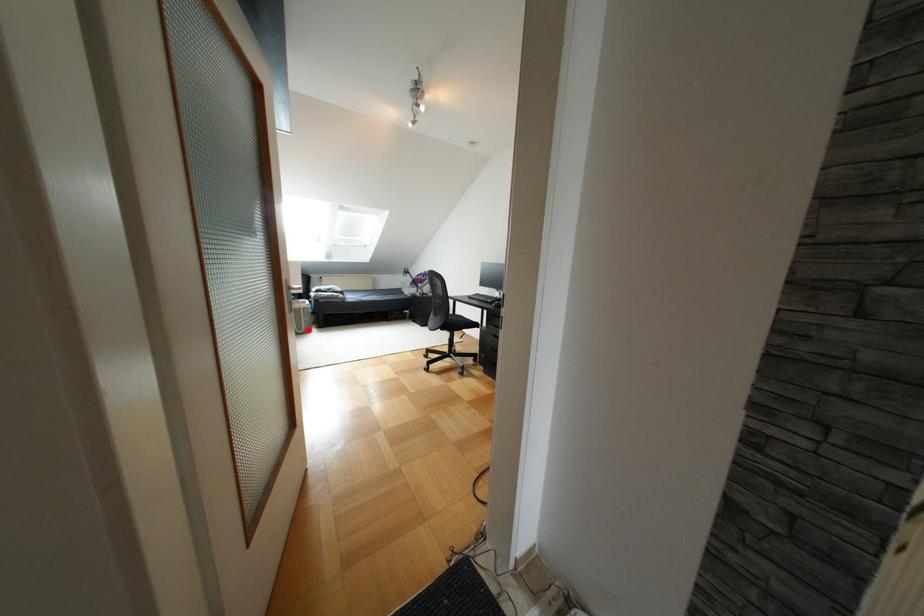
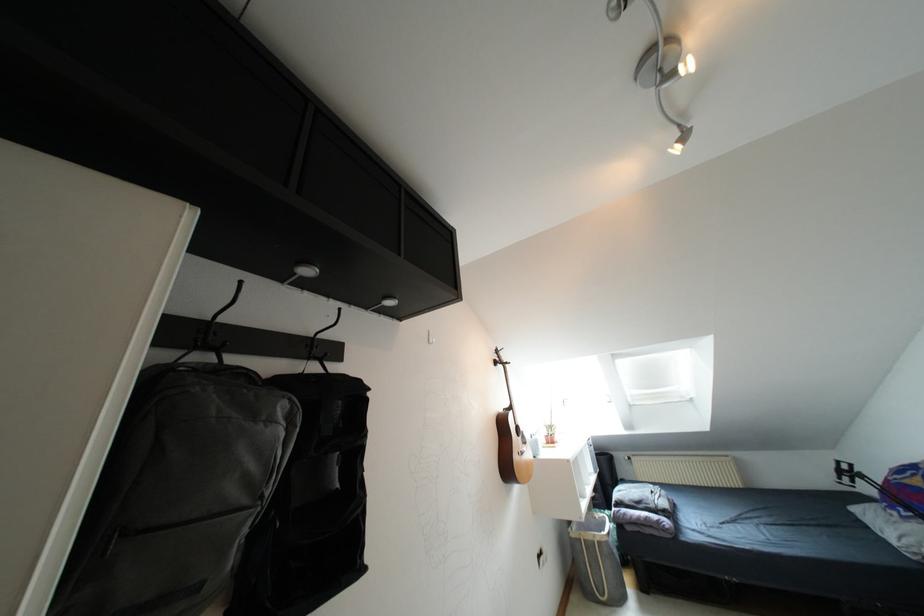
Question: I am providing you with two images of the same scene from different viewpoints. Given a red point in image1, look at the same physical point in image2. Is it:

Choices:
 (A) Closer to the viewpoint
 (B) Farther from the viewpoint

Answer: (A)